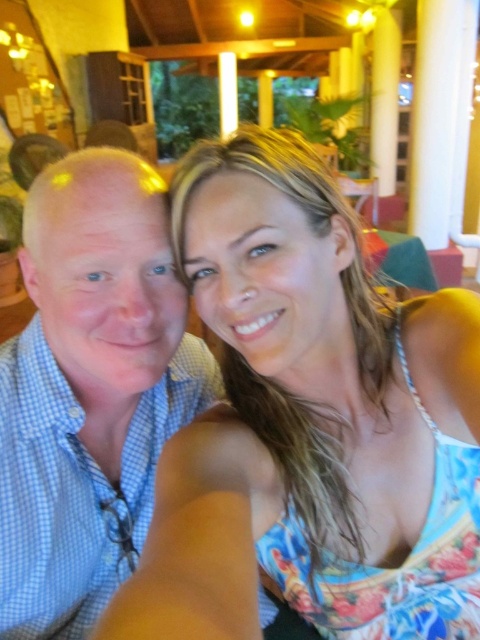
Does point (344, 301) lie behind point (39, 531)?

No, it is not.

Does floral fabric dress at center have a greater height compared to blue checkered shirt at left?

Indeed, floral fabric dress at center has a greater height compared to blue checkered shirt at left.

Is point (479, 317) positioned in front of point (0, 433)?

Yes.

Find the location of `floral fabric dress at center`. floral fabric dress at center is located at coordinates (310, 422).